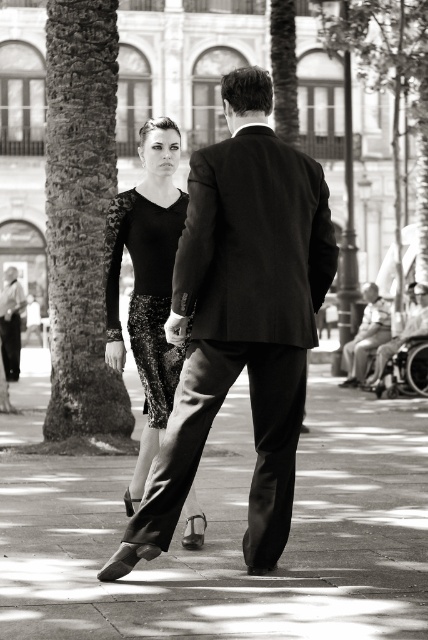
You are a photographer trying to capture a candid shot of the sequined fabric dress at center and the smooth concrete pavement at center. Since the dress is more reflective, you want to ensure the pavement is visible in the photo. Based on their heights, can you determine if the dress will block the pavement from view?

The sequined fabric dress at center is taller than the smooth concrete pavement at center, so the dress will block the pavement from view if they are positioned in a way that the dress is in front of the pavement.